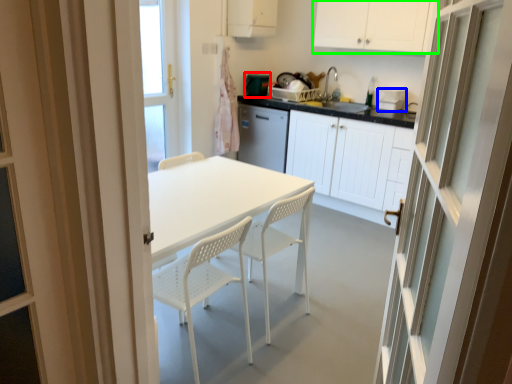
Question: Estimate the real-world distances between objects in this image. Which object is farther from appliance (highlighted by a red box), appliance (highlighted by a blue box) or cabinetry (highlighted by a green box)?

Choices:
 (A) appliance
 (B) cabinetry

Answer: (A)